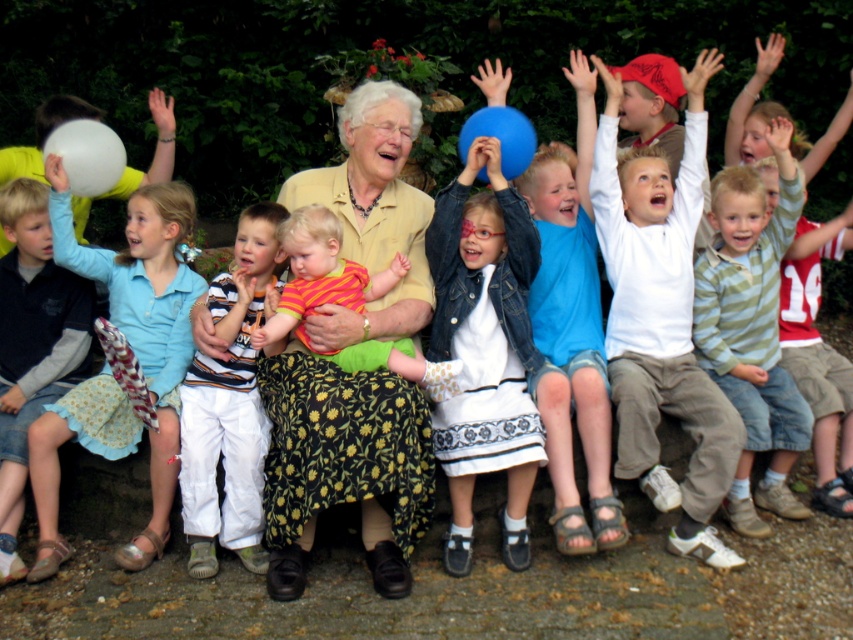
Question: Which of the following is the farthest from the observer?

Choices:
 (A) striped cotton shirt at center
 (B) white cotton pants at center
 (C) denim jacket at center
 (D) dark blue sweater at left

Answer: (A)

Question: Does matte yellow jacket at center appear on the left side of light blue cotton dress at left?

Choices:
 (A) yes
 (B) no

Answer: (B)

Question: Which object is closer to the camera taking this photo?

Choices:
 (A) blue rubber balloon at upper center
 (B) white matte balloon at left

Answer: (A)

Question: Is dark blue sweater at left positioned in front of white matte balloon at left?

Choices:
 (A) yes
 (B) no

Answer: (A)

Question: Is matte yellow jacket at center above white zip-up hoodie at upper right?

Choices:
 (A) yes
 (B) no

Answer: (B)

Question: Which of the following is the farthest from the observer?

Choices:
 (A) white zip-up hoodie at upper right
 (B) dark blue sweater at left

Answer: (A)